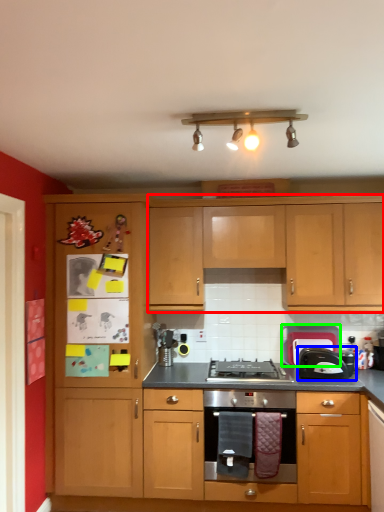
Question: Based on their relative distances, which object is nearer to cabinetry (highlighted by a red box)? Choose from toaster (highlighted by a blue box) and appliance (highlighted by a green box).

Choices:
 (A) toaster
 (B) appliance

Answer: (B)